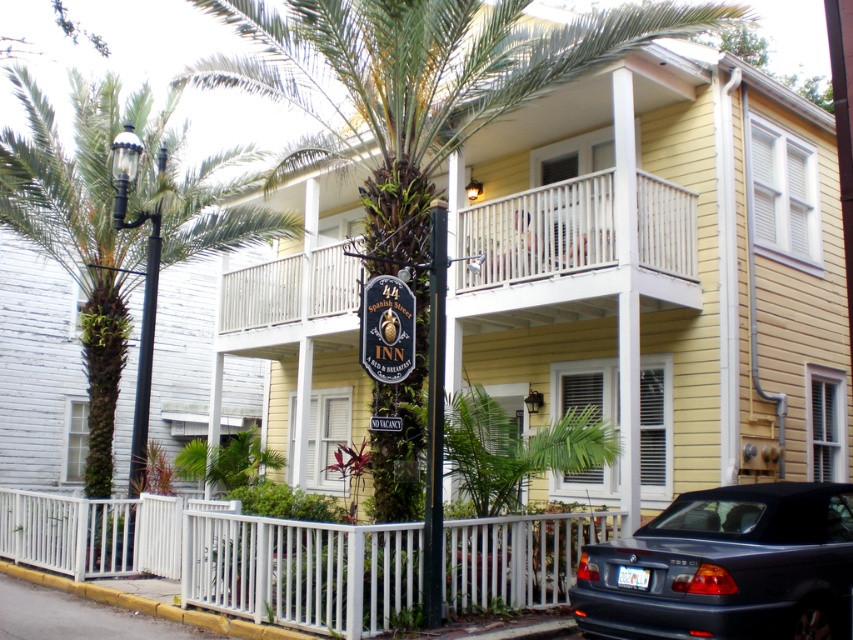
In order to click on white wooden fence at lower center in this screenshot , I will do `click(225, 556)`.

Is point (328, 586) closer to viewer compared to point (701, 554)?

That is False.

You are a GUI agent. You are given a task and a screenshot of the screen. Output one action in this format:
    pyautogui.click(x=<x>, y=<y>)
    Task: Click on the white wooden fence at lower center
    Image resolution: width=853 pixels, height=640 pixels.
    Given the screenshot: What is the action you would take?
    [225, 556]

Where is `white wooden fence at lower center`? Image resolution: width=853 pixels, height=640 pixels. white wooden fence at lower center is located at coordinates (225, 556).

Does shiny dark blue convertible at lower right lie in front of black metal streetlight at left?

Yes, shiny dark blue convertible at lower right is closer to the viewer.

Locate an element on the screen. shiny dark blue convertible at lower right is located at coordinates (726, 566).